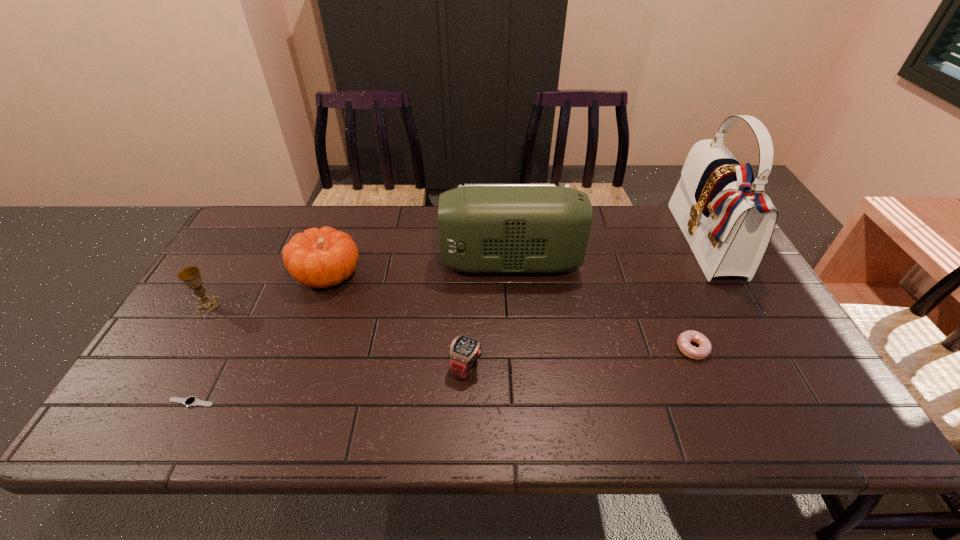
I want to click on free location located 0.150m on the back of the sixth tallest object, so click(669, 294).

The height and width of the screenshot is (540, 960). I want to click on vacant space located 0.290m on the right of the left watch, so click(x=342, y=403).

Locate an element on the screen. The width and height of the screenshot is (960, 540). satchel situated at the far edge is located at coordinates (728, 221).

Find the location of `radio_receiver at the far edge`. radio_receiver at the far edge is located at coordinates (483, 228).

I want to click on object that is at the near edge, so click(192, 400).

In order to click on chalice located in the left edge section of the desktop in this screenshot , I will do `click(190, 276)`.

You are a GUI agent. You are given a task and a screenshot of the screen. Output one action in this format:
    pyautogui.click(x=<x>, y=<y>)
    Task: Click on the watch located at the left edge
    
    Given the screenshot: What is the action you would take?
    pyautogui.click(x=192, y=400)

You are a GUI agent. You are given a task and a screenshot of the screen. Output one action in this format:
    pyautogui.click(x=<x>, y=<y>)
    Task: Click on the object that is at the right edge
    The image size is (960, 540).
    Given the screenshot: What is the action you would take?
    click(728, 221)

Where is `object that is at the near left corner`? The image size is (960, 540). object that is at the near left corner is located at coordinates (192, 400).

Locate an element on the screen. This screenshot has width=960, height=540. object that is at the far right corner is located at coordinates (728, 221).